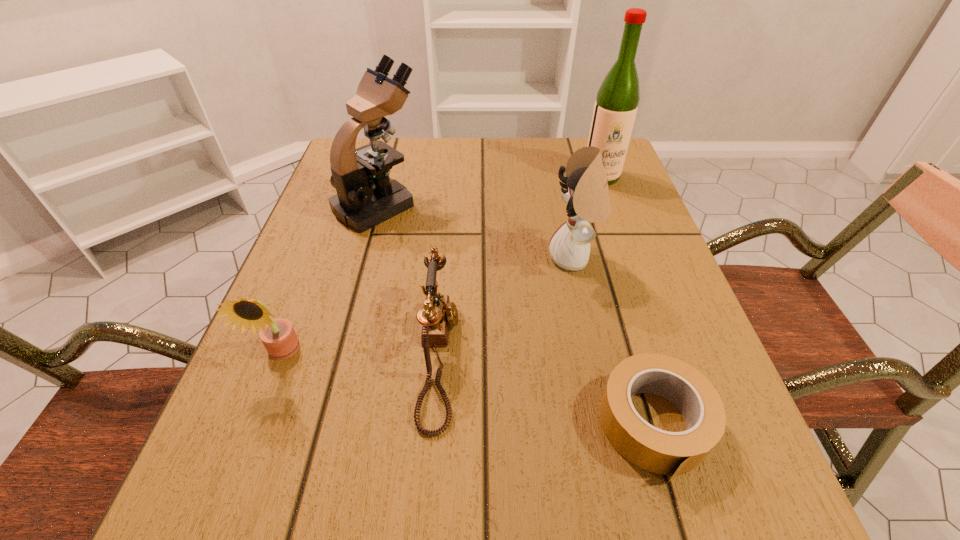
Image resolution: width=960 pixels, height=540 pixels. In order to click on vacant space positioned 0.260m at the front face of the third tallest object in this screenshot , I will do `click(419, 258)`.

Where is `vacant space located at the front face of the third tallest object`? vacant space located at the front face of the third tallest object is located at coordinates (408, 258).

At what (x,y) coordinates should I click in order to perform the action: click on vacant point located 0.210m on the face of the fourth tallest object. Please return your answer as a coordinate pair (x, y). The height and width of the screenshot is (540, 960). Looking at the image, I should click on (219, 518).

I want to click on vacant space located 0.200m on the front-facing side of the fifth tallest object, so click(581, 355).

Locate an element on the screen. vacant space located at the edge of the shortest object is located at coordinates point(687,536).

You are a GUI agent. You are given a task and a screenshot of the screen. Output one action in this format:
    pyautogui.click(x=<x>, y=<y>)
    Task: Click on the liquor at the far edge
    This screenshot has height=540, width=960.
    Given the screenshot: What is the action you would take?
    pyautogui.click(x=616, y=105)

Find the location of a particular element. microscope that is at the far edge is located at coordinates (366, 196).

Where is `object located at the near edge`? object located at the near edge is located at coordinates (662, 452).

What are the coordinates of `microscope that is at the left edge` in the screenshot? It's located at (366, 196).

Image resolution: width=960 pixels, height=540 pixels. In order to click on sunflower at the left edge in this screenshot , I will do `click(278, 335)`.